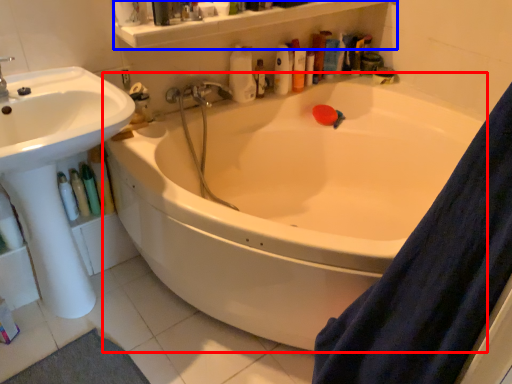
Question: Which object appears closest to the camera in this image, bathtub (highlighted by a red box) or balustrade (highlighted by a blue box)?

Choices:
 (A) bathtub
 (B) balustrade

Answer: (A)